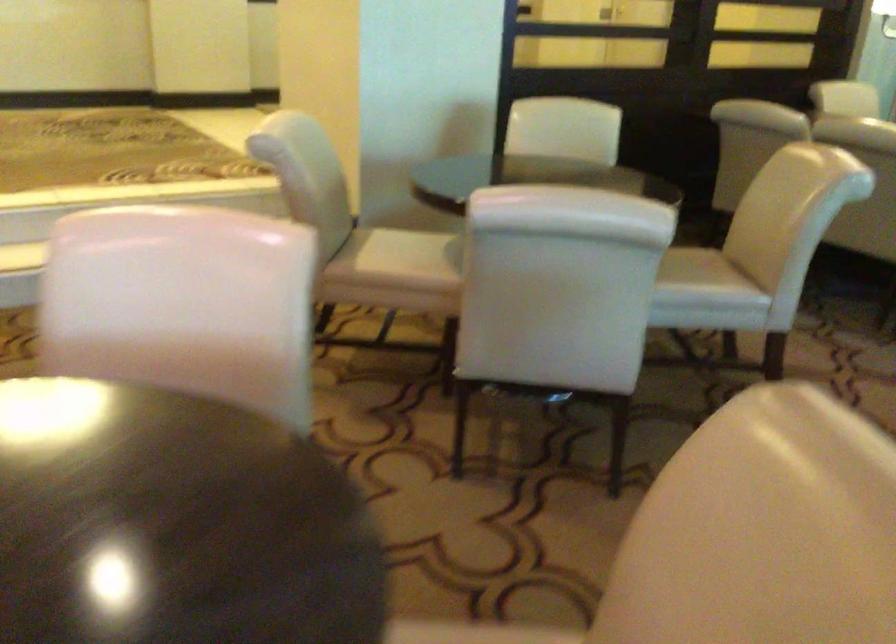
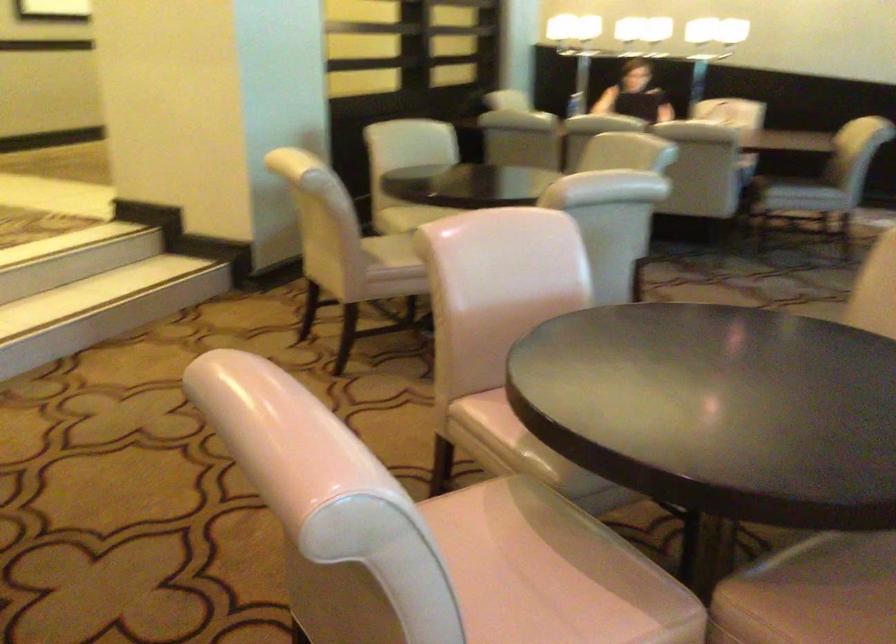
In the second image, find the point that corresponds to pixel 401 251 in the first image.

(391, 252)